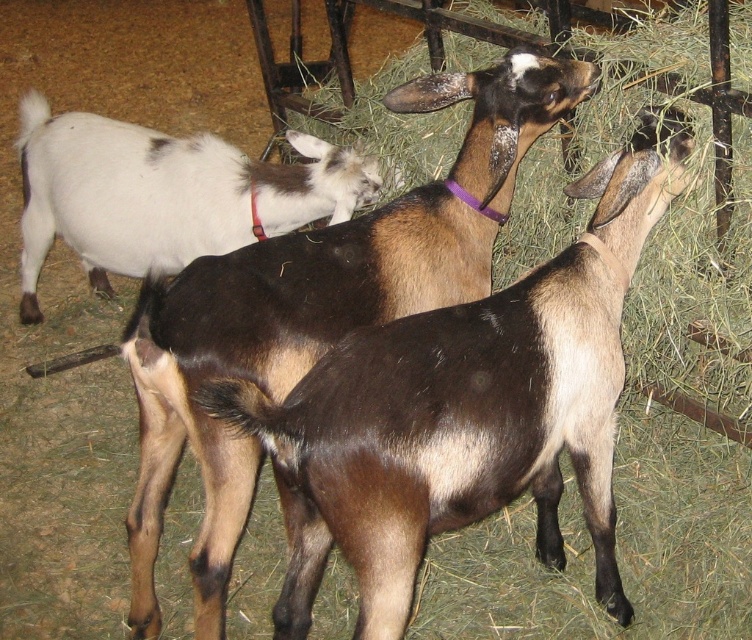
Between brown fuzzy goat at center and white matte goat at upper left, which one is positioned lower?

brown fuzzy goat at center is lower down.

Measure the distance between point (481, 436) and camera.

Point (481, 436) and camera are 1.86 meters apart from each other.

Image resolution: width=752 pixels, height=640 pixels. What are the coordinates of `brown fuzzy goat at center` in the screenshot? It's located at (464, 410).